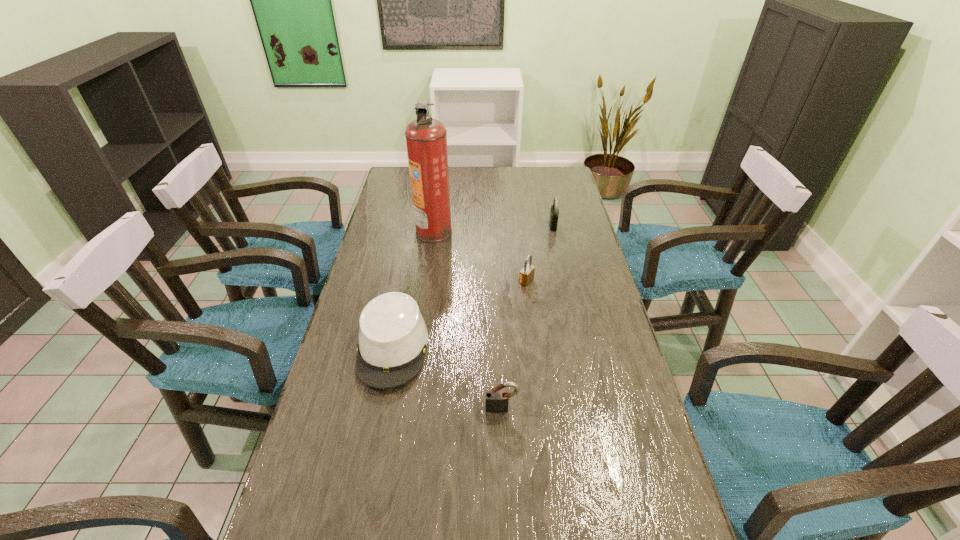
Image resolution: width=960 pixels, height=540 pixels. Identify the location of vacant space at the far right corner of the desktop. (536, 188).

Find the location of a particular element. vacant space that's between the rightmost object and the leftmost padlock is located at coordinates (527, 317).

The image size is (960, 540). I want to click on empty location between the fire extinguisher and the hat, so click(414, 290).

Where is `free space between the tallest object and the nearest object`? The width and height of the screenshot is (960, 540). free space between the tallest object and the nearest object is located at coordinates (468, 320).

Identify the location of free space between the second nearest object and the third object from left to right. (447, 379).

Locate an element on the screen. vacant space that is in between the fire extinguisher and the hat is located at coordinates (414, 290).

Identify the location of vacant space that's between the fourth farthest object and the third object from right to left. Image resolution: width=960 pixels, height=540 pixels. (447, 379).

Where is `free space between the hat and the second object from right to left`? The height and width of the screenshot is (540, 960). free space between the hat and the second object from right to left is located at coordinates (460, 315).

Identify which object is the second closest to the second nearest padlock. Please provide its 2D coordinates. Your answer should be formatted as a tuple, i.e. [(x, y)], where the tuple contains the x and y coordinates of a point satisfying the conditions above.

[(426, 138)]

Where is `object that is the closest to the leftmost padlock`? object that is the closest to the leftmost padlock is located at coordinates (393, 337).